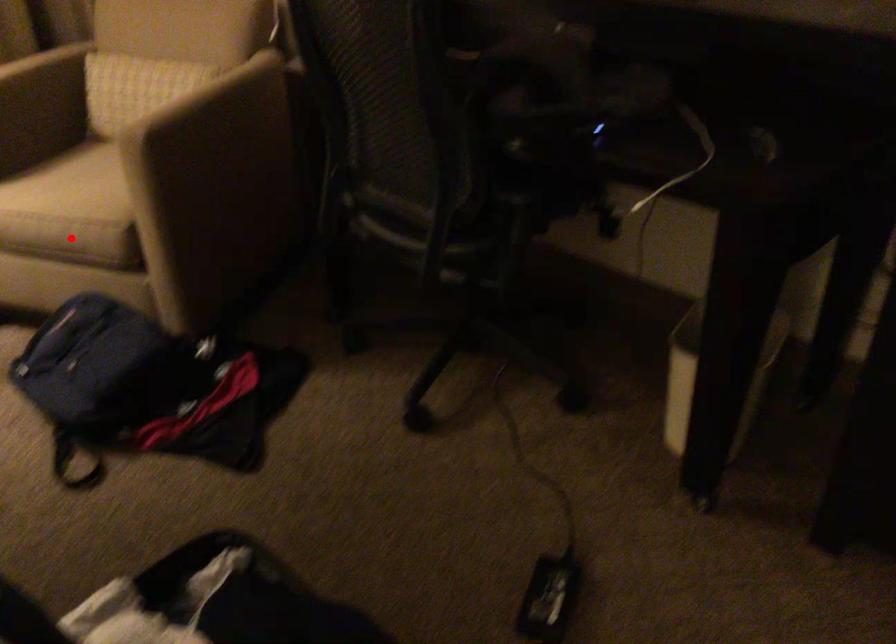
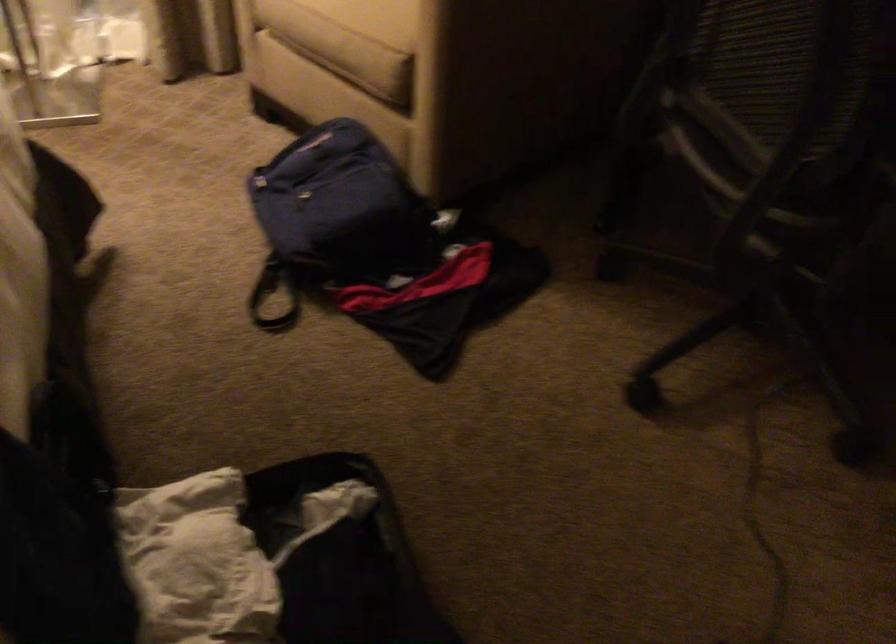
Find the pixel in the second image that matches the highlighted location in the first image.

(347, 53)